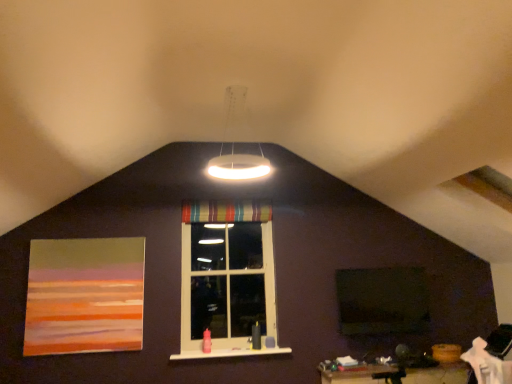
This screenshot has width=512, height=384. I want to click on blank space situated above white glossy ring light at upper center (from a real-world perspective), so click(x=239, y=82).